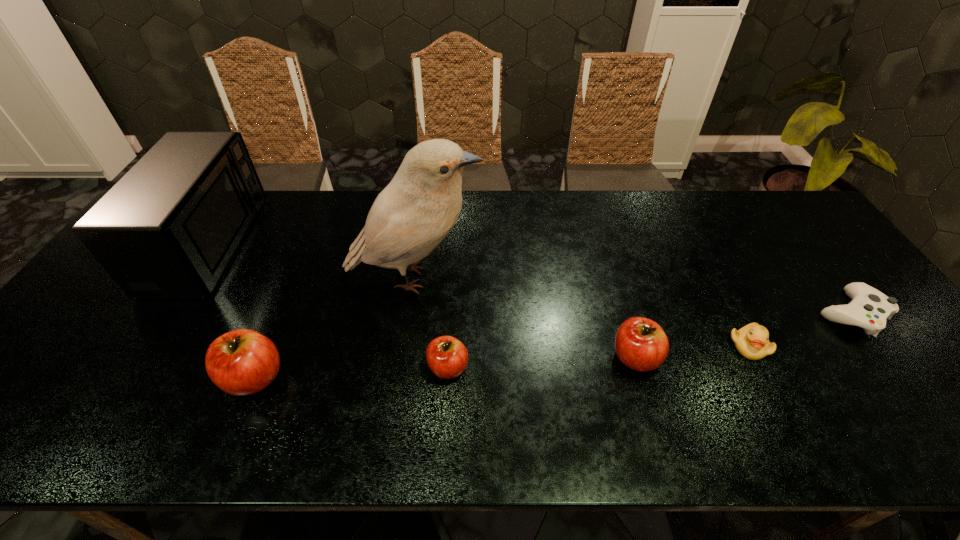
At what (x,y) coordinates should I click in order to perform the action: click on parakeet. Please return your answer as a coordinate pair (x, y). Image resolution: width=960 pixels, height=540 pixels. Looking at the image, I should click on pos(419,207).

Image resolution: width=960 pixels, height=540 pixels. Find the location of `the sixth tallest object`. the sixth tallest object is located at coordinates (752, 341).

This screenshot has width=960, height=540. What are the coordinates of `duckling` in the screenshot? It's located at (752, 341).

Find the location of a particular element. vacant space located 0.360m on the left of the tallest apple is located at coordinates (67, 377).

The width and height of the screenshot is (960, 540). I want to click on free space located on the back of the third shortest object, so click(453, 285).

The width and height of the screenshot is (960, 540). Find the location of `free space located on the back of the third object from right to left`. free space located on the back of the third object from right to left is located at coordinates (624, 318).

At what (x,y) coordinates should I click in order to perform the action: click on free space located on the front-facing side of the microwave_oven. Please return your answer as a coordinate pair (x, y). Looking at the image, I should click on (361, 244).

You are a GUI agent. You are given a task and a screenshot of the screen. Output one action in this format:
    pyautogui.click(x=<x>, y=<y>)
    Task: Click on the free space located 0.310m on the left of the shortest object
    This screenshot has height=540, width=960.
    Given the screenshot: What is the action you would take?
    pyautogui.click(x=699, y=313)

The height and width of the screenshot is (540, 960). Identify the location of vacant region located on the face of the tallest object. (575, 279).

Locate an element on the screen. The height and width of the screenshot is (540, 960). free space located 0.110m on the front-facing side of the duckling is located at coordinates (779, 404).